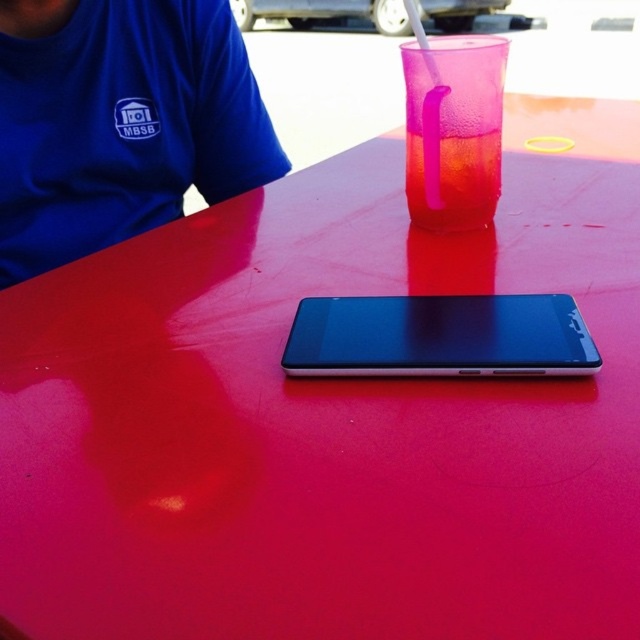
Question: Is blue fabric shirt at upper left in front of translucent pink liquid at center?

Choices:
 (A) yes
 (B) no

Answer: (B)

Question: Which of the following is the closest to the observer?

Choices:
 (A) blue fabric shirt at upper left
 (B) sleek black phone at center
 (C) translucent plastic straw at upper center
 (D) translucent pink drink at upper center

Answer: (B)

Question: Can you confirm if sleek black phone at center is thinner than translucent pink drink at upper center?

Choices:
 (A) yes
 (B) no

Answer: (B)

Question: Is sleek black phone at center closer to the viewer compared to translucent pink drink at upper center?

Choices:
 (A) yes
 (B) no

Answer: (A)

Question: Which point is farther to the camera?

Choices:
 (A) (128, 220)
 (B) (419, 196)

Answer: (A)

Question: Based on their relative distances, which object is nearer to the blue fabric shirt at upper left?

Choices:
 (A) translucent pink drink at upper center
 (B) translucent plastic straw at upper center

Answer: (B)